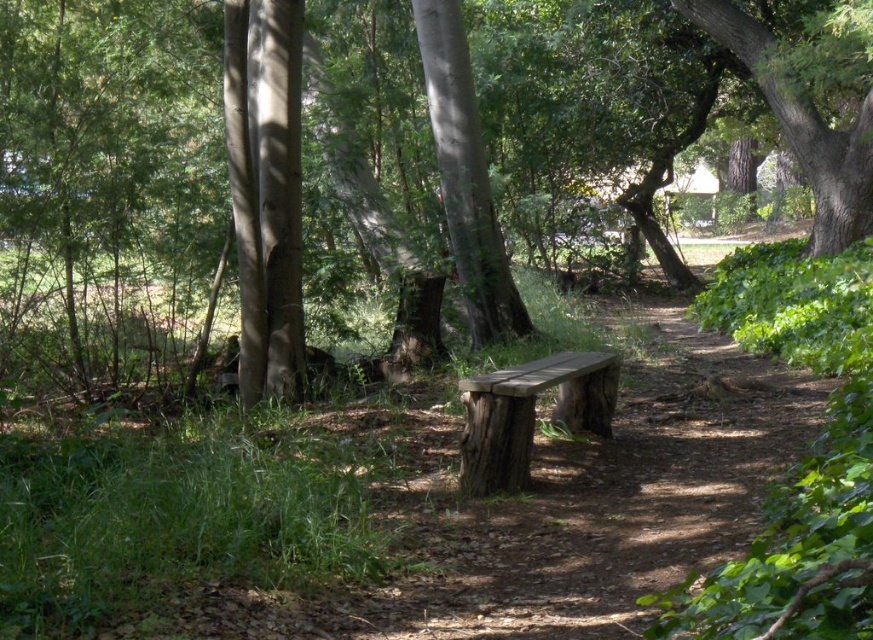
Between smooth brown tree trunk at center and smooth bark tree at center, which one has less height?

smooth brown tree trunk at center

In the scene shown: Is smooth brown tree trunk at center bigger than smooth bark tree at center?

Incorrect, smooth brown tree trunk at center is not larger than smooth bark tree at center.

Find the location of a particular element. smooth brown tree trunk at center is located at coordinates (265, 189).

Looking at this image, which of these two, smooth bark tree at center or green rough bark tree at upper right, stands shorter?

smooth bark tree at center

Is smooth bark tree at center positioned before green rough bark tree at upper right?

Yes.

This screenshot has width=873, height=640. In order to click on smooth bark tree at center in this screenshot , I will do `click(465, 177)`.

Can you confirm if smooth brown tree trunk at center is taller than green rough bark tree at upper right?

Incorrect, smooth brown tree trunk at center's height is not larger of green rough bark tree at upper right's.

Between smooth brown tree trunk at center and green rough bark tree at upper right, which one is positioned lower?

smooth brown tree trunk at center is lower down.

You are a GUI agent. You are given a task and a screenshot of the screen. Output one action in this format:
    pyautogui.click(x=<x>, y=<y>)
    Task: Click on the smooth brown tree trunk at center
    The image size is (873, 640).
    Given the screenshot: What is the action you would take?
    click(265, 189)

This screenshot has height=640, width=873. Identify the location of smooth brown tree trunk at center. (265, 189).